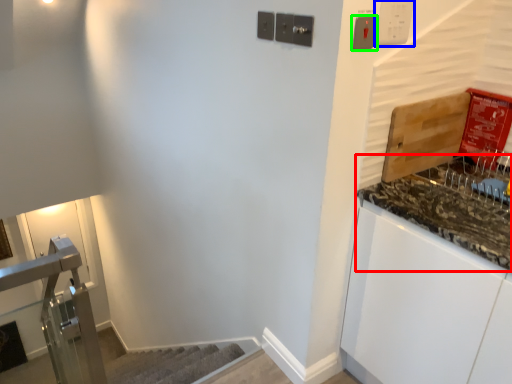
Question: Estimate the real-world distances between objects in this image. Which object is farther from countertop (highlighted by a red box), light switch (highlighted by a blue box) or light switch (highlighted by a green box)?

Choices:
 (A) light switch
 (B) light switch

Answer: (B)